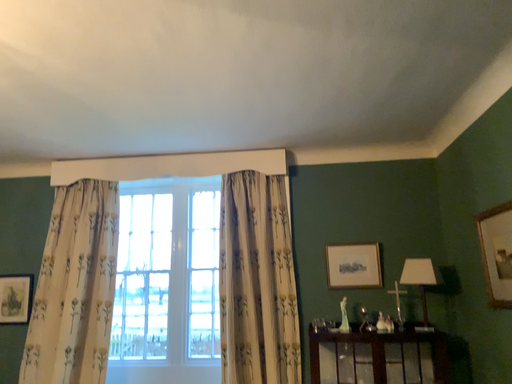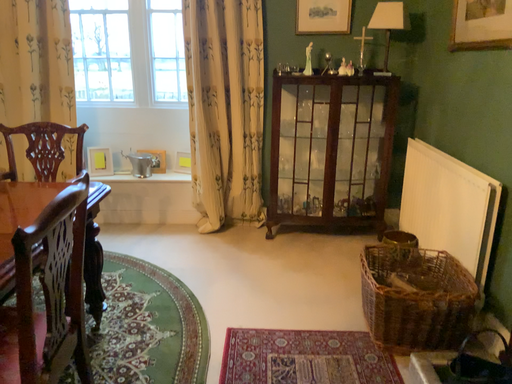
Question: Which way did the camera rotate in the video?

Choices:
 (A) rotated upward
 (B) rotated downward

Answer: (B)